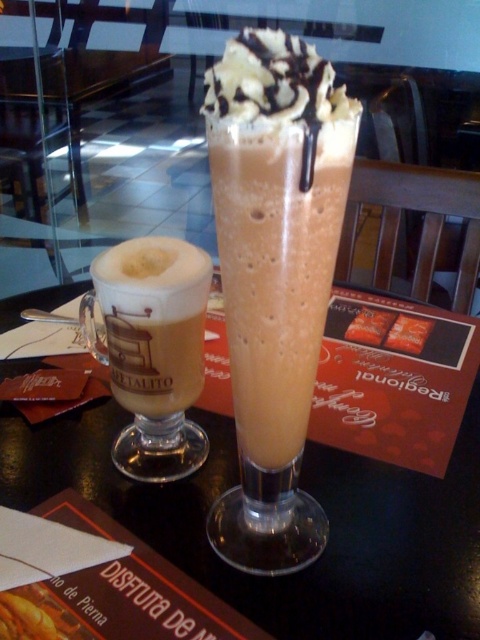
From the picture: You are a customer at CAF? TALITO and want to place your phone on the table between the two beverages. Given that the table is represented by the point at coordinates (310,493), where should you place your phone to ensure it doesn?t block either beverage?

The translucent glass table at center is represented by point (310,493). To place your phone without blocking either beverage, position it near the edge of the table away from both beverages, ensuring it stays clear of the area occupied by the two glasses.

You are a barista at CAF? TALITO and need to place a new order on the table. The new order is a small espresso shot that requires 2 inches of space. Can you fit it between the translucent glass table at center and the whipped cream topped chocolate milkshake at center?

The distance between the translucent glass table at center and the whipped cream topped chocolate milkshake at center is 4.18 inches. Since the espresso shot only needs 2 inches of space, there is enough room to place it between them.

Where is the translucent glass table at center located in the image?

The translucent glass table at center is located at point (310, 493).